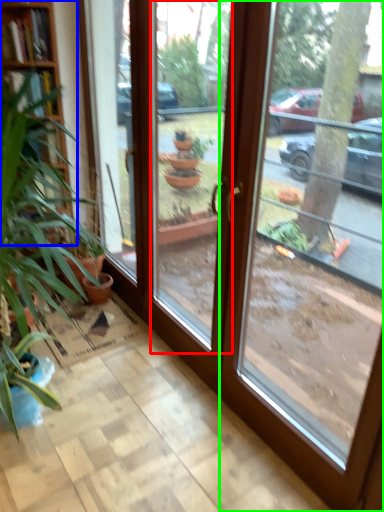
Question: Which object is the closest to the window (highlighted by a red box)? Choose among these: bookshelf (highlighted by a blue box) or window (highlighted by a green box).

Choices:
 (A) bookshelf
 (B) window

Answer: (A)